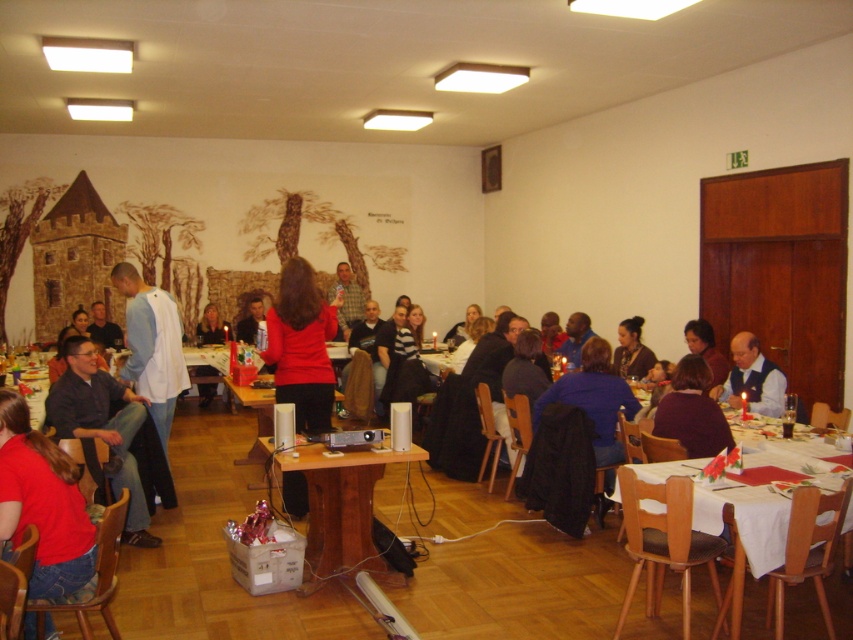
You are at the center of the room and see the dark brown hair at center and the matte red sweater at center. Which object is positioned to the right from your perspective?

The dark brown hair at center is to the right of the matte red sweater at center from your perspective.

You are organizing a costume party and need to ensure that all participants have shirts that meet the height requirement of 1.5 meters. Given that you see the red matte shirt at center and the light blue fabric shirt at center in the image, which one is more likely to meet the height requirement?

The light blue fabric shirt at center is taller than the red matte shirt at center, so it is more likely to meet the height requirement of 1.5 meters.